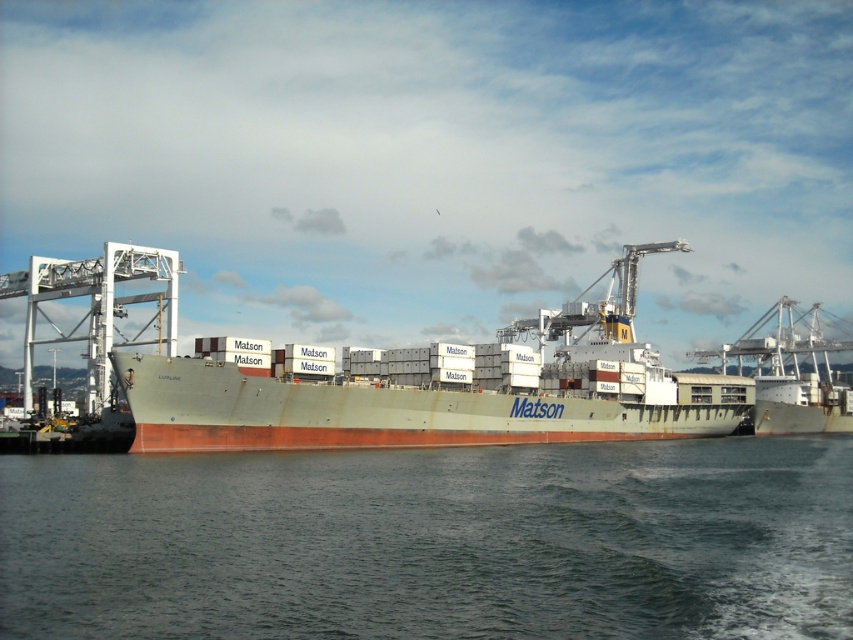
You are standing on the dock and looking at the scene. Which object is closer to you, the dark blue water at center or the green matte container ship at center?

The dark blue water at center is closer to the viewer than the green matte container ship at center according to the description.

You are a crane operator at the port, and you need to determine the vertical clearance between the dark blue water at center and the green matte container ship at center. Which object is lower in height?

The dark blue water at center has a lesser height compared to the green matte container ship at center, so the dark blue water at center is lower in height.

You are standing on the dock and want to reach a specific point on the ship labeled as point (656,545). If your maximum reach is 50 meters, can you comfortably extend your arm to touch that point?

The distance of point (656,545) from the viewer is 49.65 meters, so yes, you can comfortably extend your arm to touch that point since it is within your 50 meters reach.